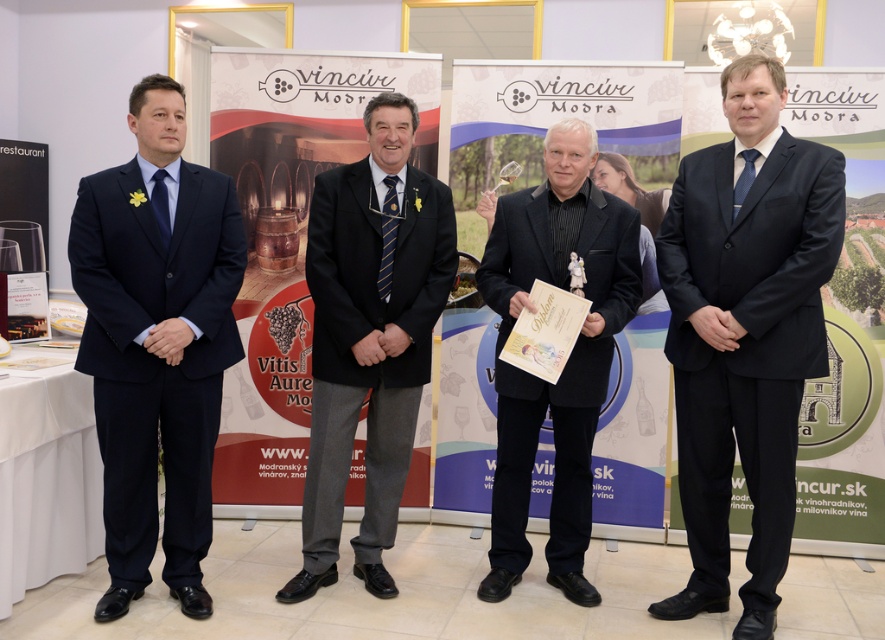
Measure the distance between matte black suit at center and camera.

matte black suit at center and camera are 8.15 feet apart.

Is point (717, 451) closer to viewer compared to point (609, 212)?

That is True.

You are a GUI agent. You are given a task and a screenshot of the screen. Output one action in this format:
    pyautogui.click(x=<x>, y=<y>)
    Task: Click on the matte black suit at center
    The width and height of the screenshot is (885, 640).
    Given the screenshot: What is the action you would take?
    pyautogui.click(x=745, y=333)

This screenshot has width=885, height=640. What do you see at coordinates (845, 323) in the screenshot?
I see `matte black signboard at center` at bounding box center [845, 323].

Does matte black signboard at center have a larger size compared to blue silk tie at right?

Yes.

Does point (867, 76) come closer to viewer compared to point (753, 148)?

No, (867, 76) is behind (753, 148).

The image size is (885, 640). I want to click on matte black signboard at center, so click(845, 323).

Between black satin suit at center and blue striped tie at center, which one appears on the right side from the viewer's perspective?

Positioned to the right is black satin suit at center.

Can you confirm if black satin suit at center is positioned to the left of blue striped tie at center?

No, black satin suit at center is not to the left of blue striped tie at center.

This screenshot has width=885, height=640. Find the location of `black satin suit at center`. black satin suit at center is located at coordinates (567, 358).